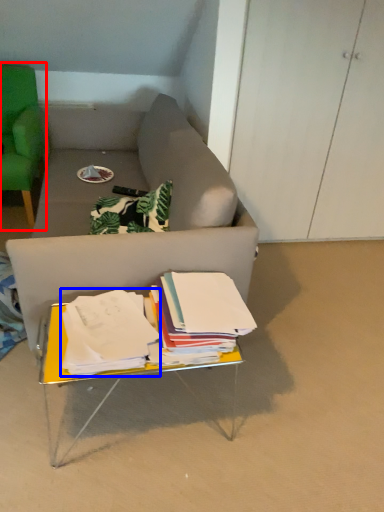
Question: Among these objects, which one is nearest to the camera, chair (highlighted by a red box) or paperback book (highlighted by a blue box)?

Choices:
 (A) chair
 (B) paperback book

Answer: (B)